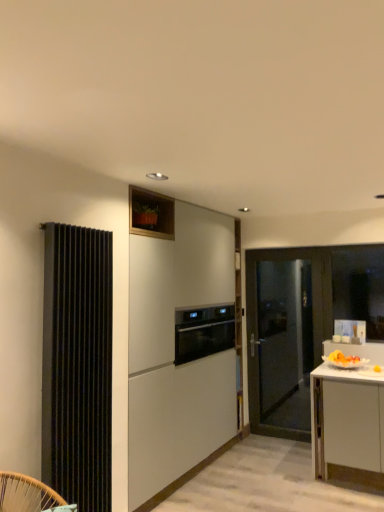
Question: From a real-world perspective, is matte black door at right located beneath satin black oven at center?

Choices:
 (A) yes
 (B) no

Answer: (A)

Question: Considering the relative sizes of matte black door at right and satin black oven at center in the image provided, is matte black door at right smaller than satin black oven at center?

Choices:
 (A) yes
 (B) no

Answer: (B)

Question: Is satin black oven at center inside matte black door at right?

Choices:
 (A) no
 (B) yes

Answer: (A)

Question: Is matte black door at right positioned beyond the bounds of satin black oven at center?

Choices:
 (A) yes
 (B) no

Answer: (A)

Question: Is matte black door at right in front of satin black oven at center?

Choices:
 (A) yes
 (B) no

Answer: (B)

Question: From a real-world perspective, is white matte cabinet at center physically located above or below matte black door at right?

Choices:
 (A) below
 (B) above

Answer: (B)

Question: From their relative heights in the image, would you say white matte cabinet at center is taller or shorter than matte black door at right?

Choices:
 (A) tall
 (B) short

Answer: (A)

Question: From the image's perspective, relative to matte black door at right, is white matte cabinet at center above or below?

Choices:
 (A) above
 (B) below

Answer: (A)

Question: Considering their positions, is white matte cabinet at center located in front of or behind matte black door at right?

Choices:
 (A) front
 (B) behind

Answer: (A)

Question: Choose the correct answer: Is transparent glass window at right inside black ribbed radiator at left or outside it?

Choices:
 (A) inside
 (B) outside

Answer: (B)

Question: Is transparent glass window at right to the left or to the right of black ribbed radiator at left in the image?

Choices:
 (A) left
 (B) right

Answer: (B)

Question: Considering the positions of point (344, 280) and point (92, 241), is point (344, 280) closer or farther from the camera than point (92, 241)?

Choices:
 (A) farther
 (B) closer

Answer: (A)

Question: In terms of size, does transparent glass window at right appear bigger or smaller than black ribbed radiator at left?

Choices:
 (A) big
 (B) small

Answer: (B)

Question: Is satin black oven at center taller or shorter than matte black door at right?

Choices:
 (A) tall
 (B) short

Answer: (B)

Question: Based on their positions, is satin black oven at center located to the left or right of matte black door at right?

Choices:
 (A) left
 (B) right

Answer: (A)